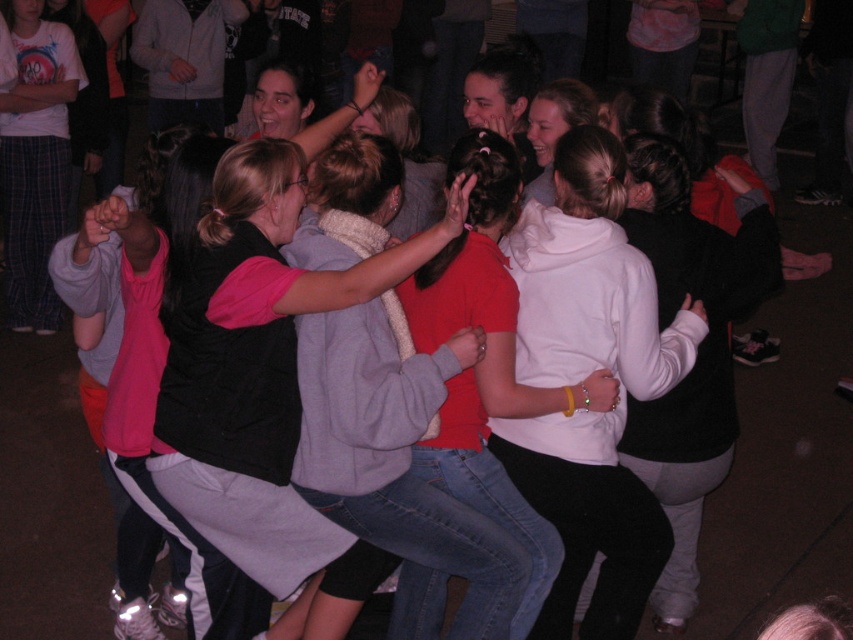
Question: Can you confirm if white fleece hoodie at center is positioned below matte black vest at center?

Choices:
 (A) yes
 (B) no

Answer: (A)

Question: Considering the relative positions of white fleece hoodie at center and matte black vest at center in the image provided, where is white fleece hoodie at center located with respect to matte black vest at center?

Choices:
 (A) above
 (B) below

Answer: (B)

Question: Which object is farther from the camera taking this photo?

Choices:
 (A) matte black vest at center
 (B) white fleece hoodie at center

Answer: (B)

Question: Is white fleece hoodie at center below matte black vest at center?

Choices:
 (A) no
 (B) yes

Answer: (B)

Question: Which point is closer to the camera taking this photo?

Choices:
 (A) (277, 348)
 (B) (585, 291)

Answer: (A)